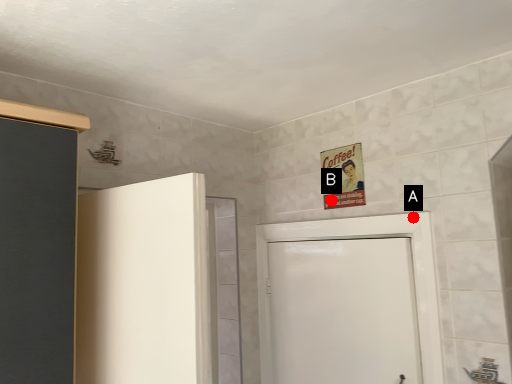
Question: Two points are circled on the image, labeled by A and B beside each circle. Which point is closer to the camera?

Choices:
 (A) A is closer
 (B) B is closer

Answer: (A)